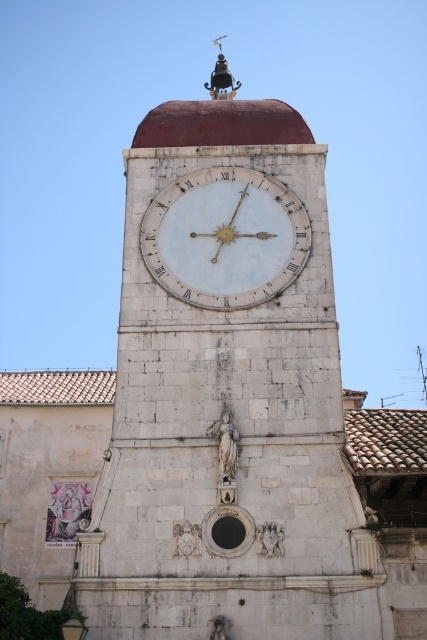
You are standing in front of the historic clock tower. You want to take a photo of the white stone clock at center. If your camera can focus on objects up to 35 meters away, will you need to adjust your position to get a clear picture?

The white stone clock at center is 36.94 meters from the camera, which is beyond the camera focus limit of 35 meters. You need to move closer to the white stone clock at center to ensure it is within the focus range.

You are standing in front of the historic clock tower. You see the white marble clock at center and the polished brass bell at upper center. Which object is positioned higher up in the tower?

The polished brass bell at upper center is positioned higher up in the tower than the white marble clock at center.

You are standing in front of the historic clock tower and want to take a photo. You notice two points on the tower marked as point 1 at coordinates (257, 310) and point 2 at coordinates (224, 93). Which point is closer to your camera when taking the photo?

Point 1 at coordinates (257, 310) is closer to the camera than point 2 at coordinates (224, 93).